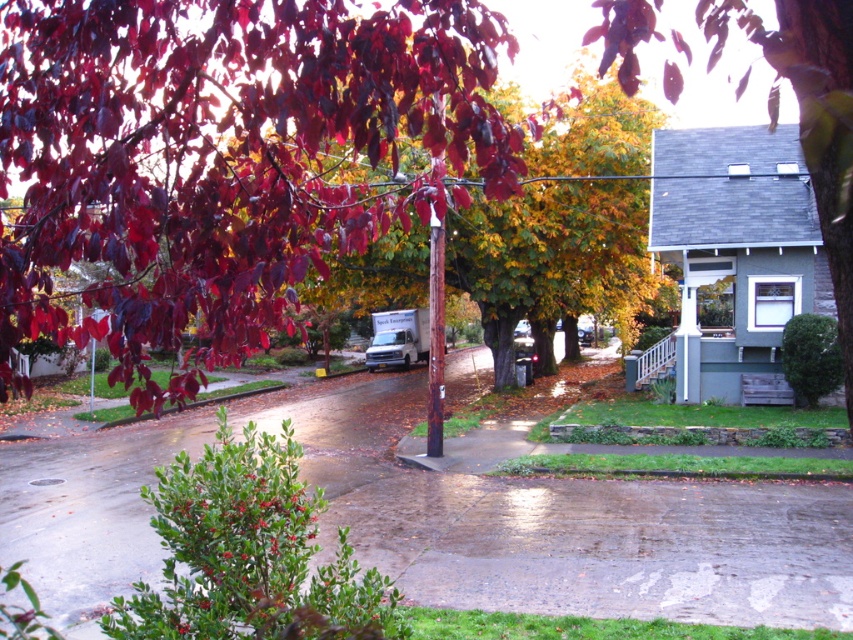
Which is more to the right, shiny crimson leaves at upper left or green leafy tree at upper right?

Positioned to the right is green leafy tree at upper right.

Looking at this image, who is positioned more to the left, shiny crimson leaves at upper left or green leafy tree at upper right?

Positioned to the left is shiny crimson leaves at upper left.

Which is behind, point (148, 145) or point (625, 22)?

The point (148, 145) is behind.

At what (x,y) coordinates should I click in order to perform the action: click on shiny crimson leaves at upper left. Please return your answer as a coordinate pair (x, y). Image resolution: width=853 pixels, height=640 pixels. Looking at the image, I should click on (223, 157).